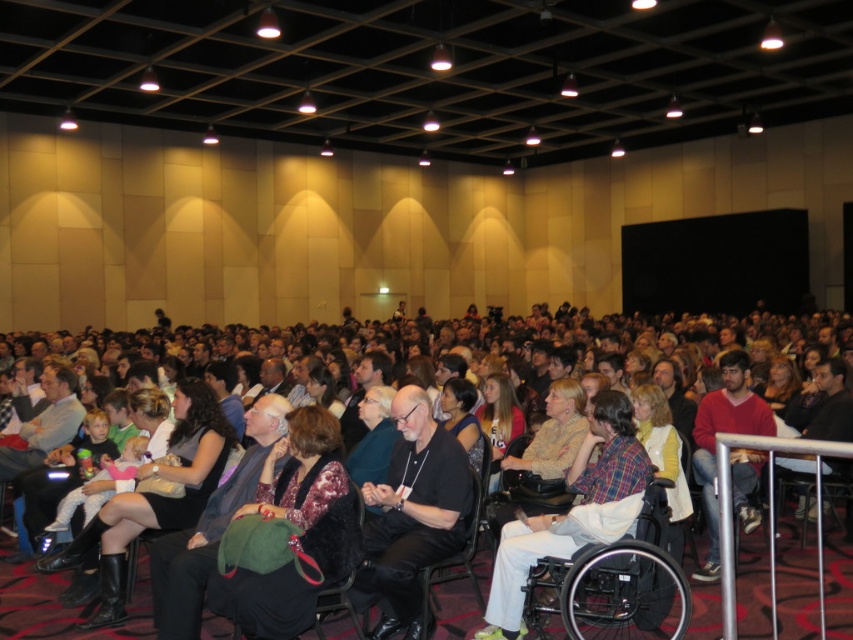
Question: Considering the real-world distances, which object is farthest from the white plastic wheelchair at lower center?

Choices:
 (A) red sweater at center
 (B) black matte shirt at center

Answer: (A)

Question: In this image, where is white plastic wheelchair at lower center located relative to red sweater at center?

Choices:
 (A) left
 (B) right

Answer: (A)

Question: Estimate the real-world distances between objects in this image. Which object is closer to the red sweater at center?

Choices:
 (A) black matte shirt at center
 (B) white plastic wheelchair at lower center

Answer: (B)

Question: Is the position of black matte shirt at center more distant than that of red sweater at center?

Choices:
 (A) yes
 (B) no

Answer: (B)

Question: Which object appears closest to the camera in this image?

Choices:
 (A) black matte shirt at center
 (B) white plastic wheelchair at lower center

Answer: (B)

Question: Is black matte shirt at center positioned before white plastic wheelchair at lower center?

Choices:
 (A) no
 (B) yes

Answer: (A)